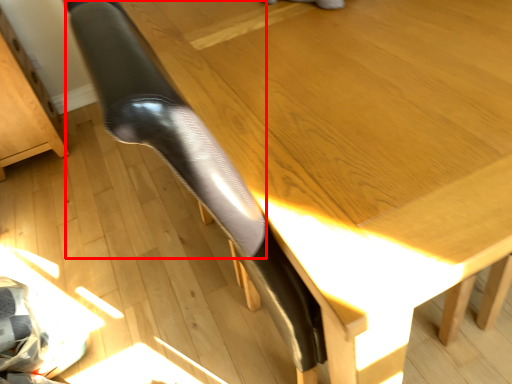
Question: From the image's perspective, what is the correct spatial positioning of leg (annotated by the red box) in reference to furniture?

Choices:
 (A) below
 (B) above

Answer: (A)